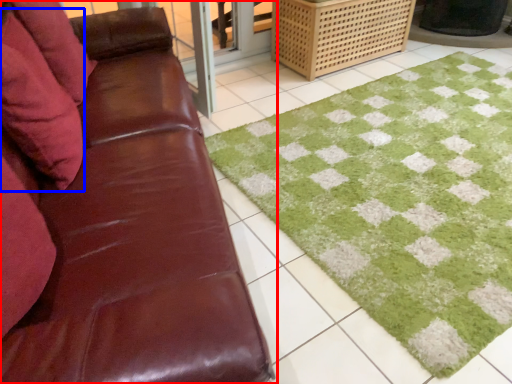
Question: Which object is closer to the camera taking this photo, studio couch (highlighted by a red box) or pillow (highlighted by a blue box)?

Choices:
 (A) studio couch
 (B) pillow

Answer: (A)